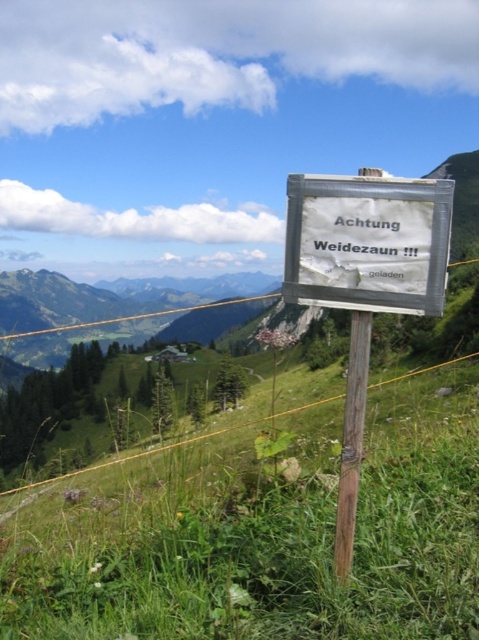
Measure the distance between green grassy at center and camera.

green grassy at center is 2.36 meters away from camera.

Is point (405, 545) positioned after point (317, 248)?

Yes.

Between point (442, 484) and point (430, 275), which one is positioned behind?

The point (442, 484) is behind.

This screenshot has height=640, width=479. Find the location of `green grassy at center`. green grassy at center is located at coordinates (262, 528).

Can you confirm if green grassy at center is positioned below brown wooden pole at center?

Yes.

Does green grassy at center have a smaller size compared to brown wooden pole at center?

Actually, green grassy at center might be larger than brown wooden pole at center.

The height and width of the screenshot is (640, 479). What are the coordinates of `green grassy at center` in the screenshot? It's located at pyautogui.click(x=262, y=528).

You are a GUI agent. You are given a task and a screenshot of the screen. Output one action in this format:
    pyautogui.click(x=<x>, y=<y>)
    Task: Click on the green grassy at center
    
    Given the screenshot: What is the action you would take?
    pyautogui.click(x=262, y=528)

Who is positioned more to the left, white paper sign at center or brown wooden pole at center?

white paper sign at center

Between white paper sign at center and brown wooden pole at center, which one is positioned lower?

brown wooden pole at center is below.

You are a GUI agent. You are given a task and a screenshot of the screen. Output one action in this format:
    pyautogui.click(x=<x>, y=<y>)
    Task: Click on the white paper sign at center
    
    Given the screenshot: What is the action you would take?
    [367, 243]